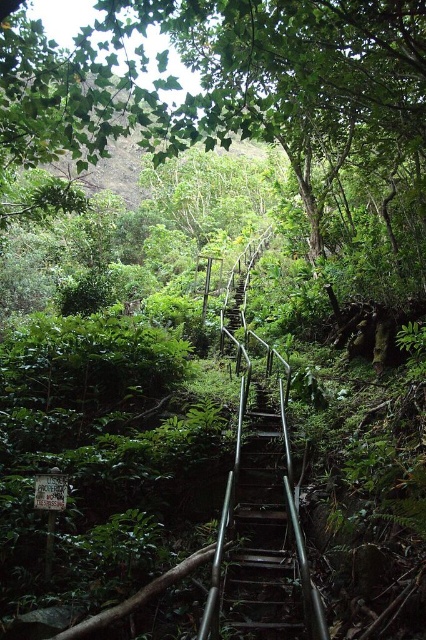
From the picture: You are a hiker trying to reach the top of the metallic silver stairs at center. There is a green leafy tree at upper center blocking your path. Can you climb over the tree to continue your ascent?

The green leafy tree at upper center is 12.20 meters away from the metallic silver stairs at center, so it is too far to climb over and continue your ascent.

In the scene shown: You are a hiker trying to reach the top of the stairs. You notice the green leafy tree at upper center and the metallic silver stairs at center. Which object is wider from your viewpoint?

The green leafy tree at upper center is wider than the metallic silver stairs at center.

You are a hiker trying to reach the top of the stairs. You notice the green leafy tree at upper center and the metallic silver stairs at center. Which object is taller and could potentially block your view while climbing the stairs?

The green leafy tree at upper center is taller than the metallic silver stairs at center, so it could potentially block your view while climbing the stairs.